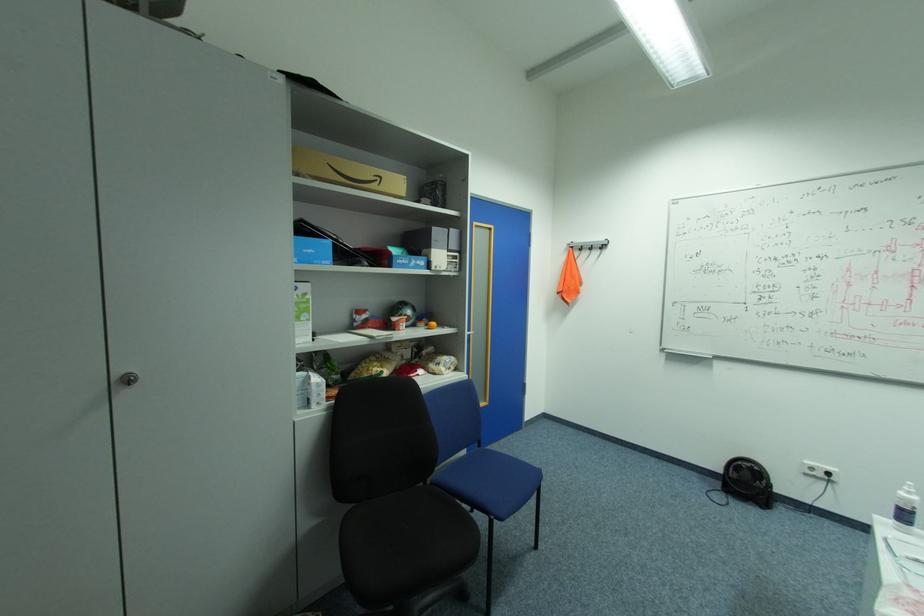
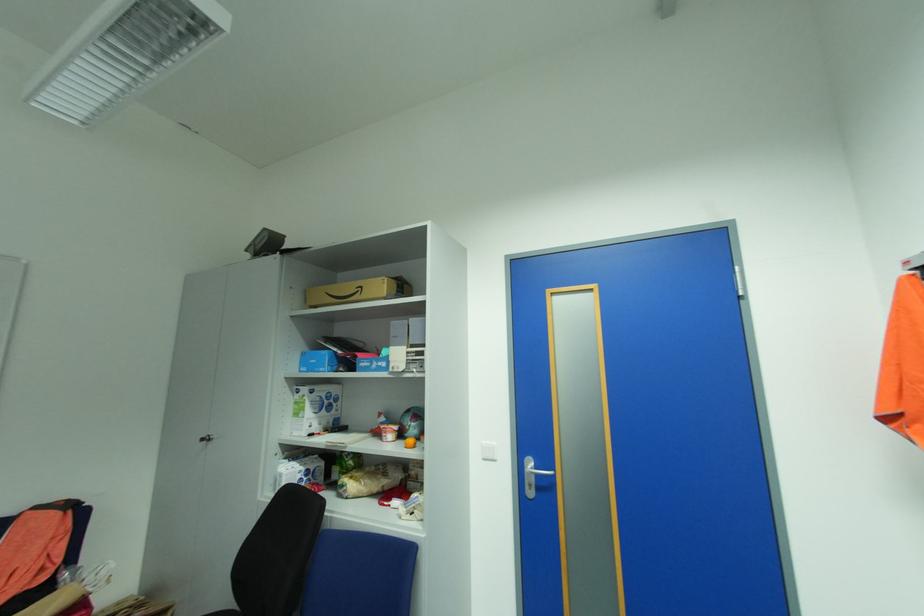
Where in the second image is the point corresponding to [331,262] from the first image?

(327, 370)